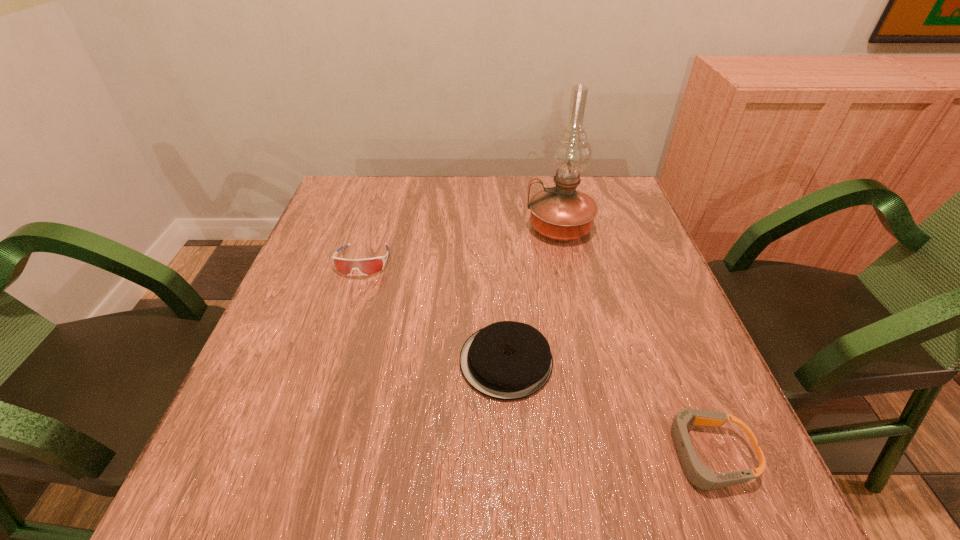
Where is `free space between the tallest object and the right goggles`? The image size is (960, 540). free space between the tallest object and the right goggles is located at coordinates pyautogui.click(x=634, y=341).

The image size is (960, 540). What are the coordinates of `vacant area that lies between the third farthest object and the farther goggles` in the screenshot? It's located at (435, 311).

The width and height of the screenshot is (960, 540). I want to click on empty space between the pancake and the farther goggles, so click(435, 311).

Locate an element on the screen. This screenshot has height=540, width=960. free point between the farther goggles and the third farthest object is located at coordinates (435, 311).

This screenshot has height=540, width=960. What are the coordinates of `object identified as the second closest to the right goggles` in the screenshot? It's located at (561, 213).

Select which object is the closest to the leftmost object. Please provide its 2D coordinates. Your answer should be formatted as a tuple, i.e. [(x, y)], where the tuple contains the x and y coordinates of a point satisfying the conditions above.

[(507, 360)]

You are a GUI agent. You are given a task and a screenshot of the screen. Output one action in this format:
    pyautogui.click(x=<x>, y=<y>)
    Task: Click on the vacant region that satisfies the following two spatial constraints: 1. on the front-facing side of the farther goggles; 2. on the right side of the pancake
    
    Given the screenshot: What is the action you would take?
    pyautogui.click(x=332, y=361)

Find the location of `free space that satisfies the following two spatial constraints: 1. on the front-facing side of the second nearest object; 2. on the right side of the taller goggles`. free space that satisfies the following two spatial constraints: 1. on the front-facing side of the second nearest object; 2. on the right side of the taller goggles is located at coordinates (332, 361).